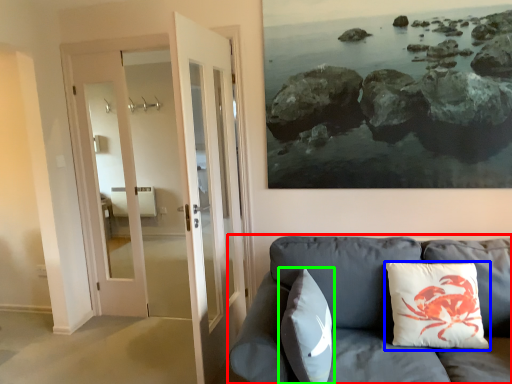
Question: Which object is positioned closest to studio couch (highlighted by a red box)? Select from pillow (highlighted by a blue box) and pillow (highlighted by a green box).

Choices:
 (A) pillow
 (B) pillow

Answer: (A)